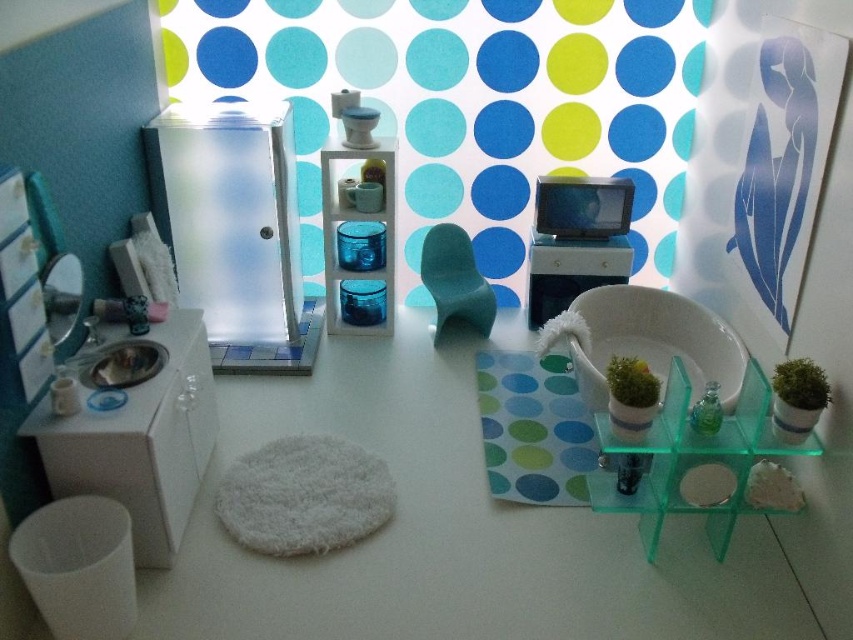
You are designing a miniature bathroom and need to place a decorative item on the translucent green glass shelf at center right and the satin white vanity at center. Which object has a wider surface area to accommodate larger items?

The translucent green glass shelf at center right has a larger width than the satin white vanity at center, so it can accommodate larger items.

You are a small toy measuring 1 foot in length that needs to reach the spongy rubber at center from the translucent green glass shelf at center right. Can you move directly to it without any obstacles?

The translucent green glass shelf at center right is 3.51 feet away from the spongy rubber at center. Since the toy is only 1 foot long, it cannot cover the distance directly. It would need assistance or a path to reach the spongy rubber at center.

You are arranging a miniature bathroom scene and need to place a small potted plant between the frosted glass cabinet at upper left and the green moss at center. Based on their positions, which object should the plant be closer to?

The plant should be placed closer to the green moss at center because the frosted glass cabinet at upper left is on the left side of the green moss at center, so the center position allows the plant to be between them.